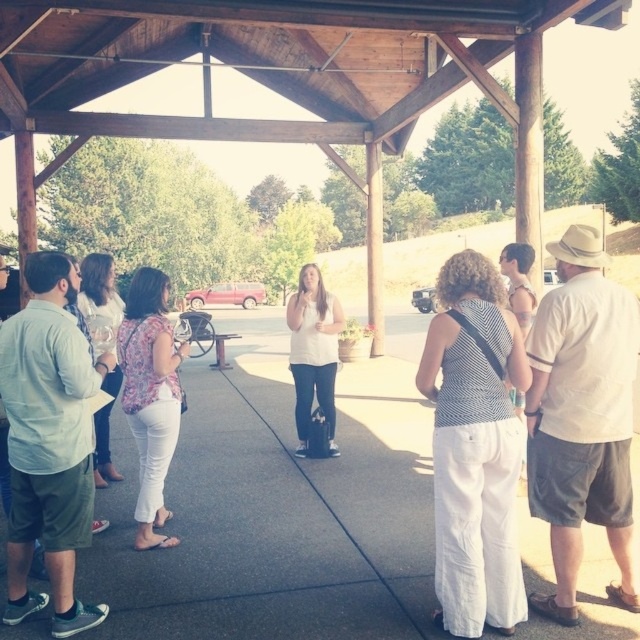
You are standing at the position of the camera, looking at the wooden pavilion where the group is gathered. There are two points marked in the image at coordinates point (x=145, y=320) and point (x=298, y=337). Which of these points is closer to your current position?

Point (x=145, y=320) is closer to the camera than point (x=298, y=337), so the point closer to your current position is point (x=145, y=320).

You are part of the group under the pavilion and want to see the speaker clearly. Which person should you move in front of, the floral fabric blouse at center or the white matte shirt at center?

You should move in front of the white matte shirt at center because the floral fabric blouse at center is already in front of it, blocking the view.